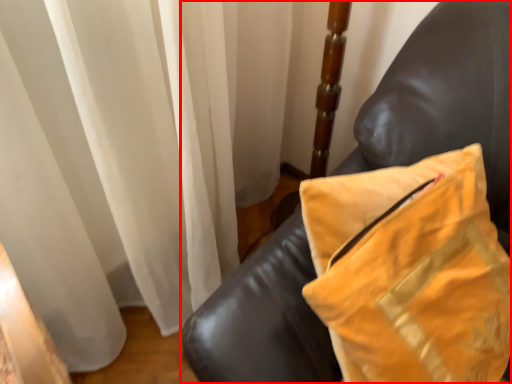
Question: Where is furniture (annotated by the red box) located in relation to pillow in the image?

Choices:
 (A) right
 (B) left

Answer: (B)